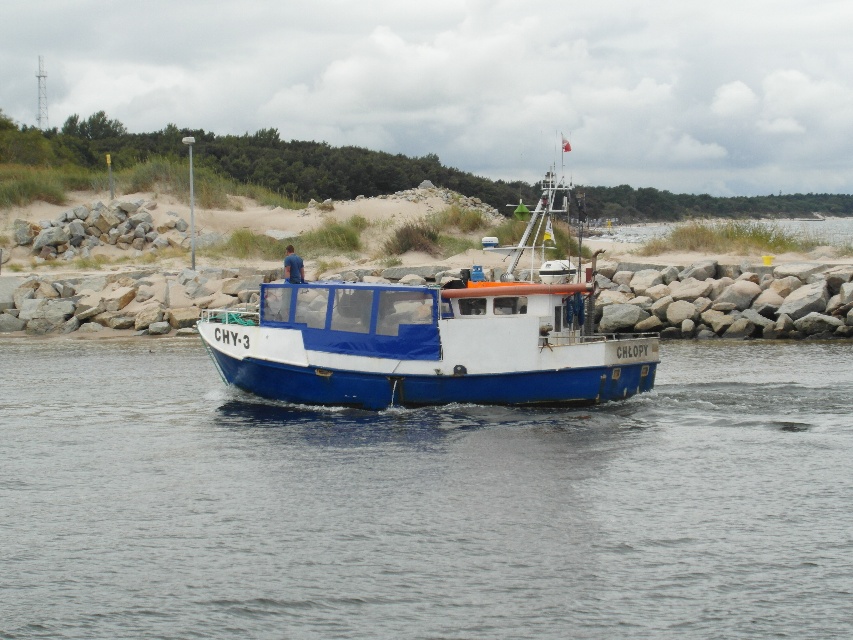
You are a sailor on the blue matte boat at center, and you need to anchor it in the blue matte water at center. Given that the anchor chain can extend up to 10 feet, will the anchor reach the water from the boat?

The distance between the blue matte water at center and the blue matte boat at center is 11.54 feet, which exceeds the anchor chain length of 10 feet. Therefore, the anchor will not reach the water from the boat.